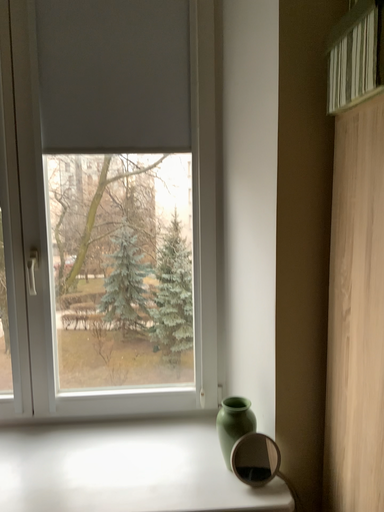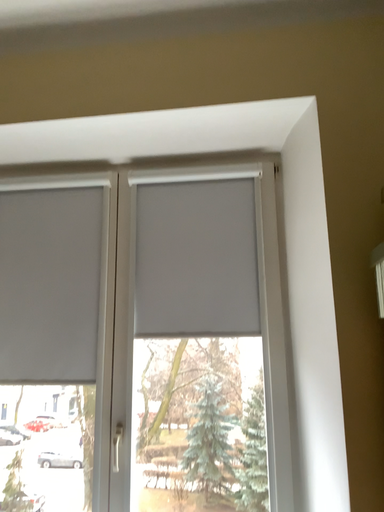
Question: How did the camera likely rotate when shooting the video?

Choices:
 (A) rotated left
 (B) rotated right

Answer: (A)